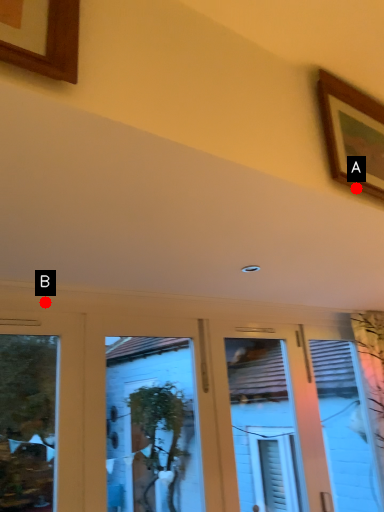
Question: Two points are circled on the image, labeled by A and B beside each circle. Which of the following is the farthest from the observer?

Choices:
 (A) A is further
 (B) B is further

Answer: (B)